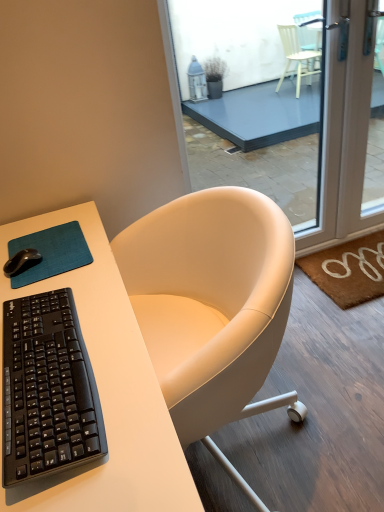
Locate an element on the screen. Image resolution: width=384 pixels, height=512 pixels. empty space that is ontop of white leather chair at center is located at coordinates (334, 384).